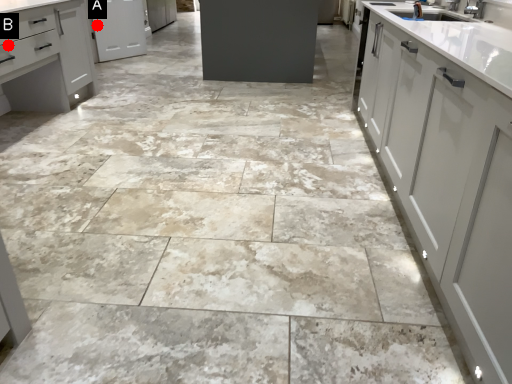
Question: Two points are circled on the image, labeled by A and B beside each circle. Among these points, which one is farthest from the camera?

Choices:
 (A) A is further
 (B) B is further

Answer: (A)